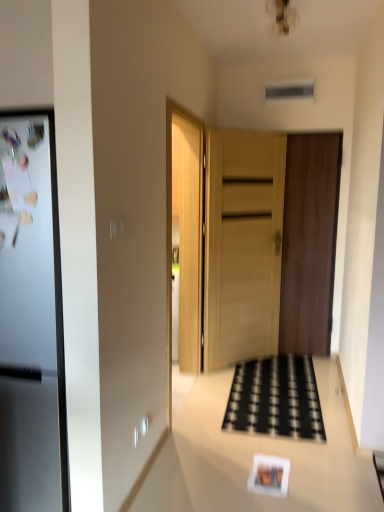
In the scene shown: In order to face black woven mat at center, should I rotate leftwards or rightwards?

A 11.049 degree turn to the right will do.

Describe the element at coordinates (269, 475) in the screenshot. I see `matte paper postcard at lower center` at that location.

I want to click on white glossy counter top at center, so click(264, 453).

Where is `black woven mat at center`? black woven mat at center is located at coordinates (276, 399).

Considering the relative sizes of wooden door at center, which appears as the 2th door when viewed from the right, and sleek metallic fridge at left in the image provided, is wooden door at center, which appears as the 2th door when viewed from the right, taller than sleek metallic fridge at left?

Yes.

Considering the relative sizes of wooden door at center, which appears as the 2th door when viewed from the right, and sleek metallic fridge at left in the image provided, is wooden door at center, which appears as the 2th door when viewed from the right, bigger than sleek metallic fridge at left?

Incorrect, wooden door at center, which appears as the 2th door when viewed from the right, is not larger than sleek metallic fridge at left.

From the image's perspective, which is below, wooden door at center, which is the first door from left to right, or sleek metallic fridge at left?

sleek metallic fridge at left appears lower in the image.

This screenshot has height=512, width=384. In order to click on counter top in front of the wooden door at center, which appears as the 2th door when viewed from the right in this screenshot , I will do `click(264, 453)`.

Is wooden door at center, which is the first door from left to right, turned away from white glossy counter top at center?

No, wooden door at center, which is the first door from left to right,'s orientation is not away from white glossy counter top at center.

Would you say wooden door at center, which appears as the 2th door when viewed from the right, contains white glossy counter top at center?

Actually, white glossy counter top at center is outside wooden door at center, which appears as the 2th door when viewed from the right.

Which object is further away from the camera, wooden door at center, which appears as the 2th door when viewed from the right, or white glossy counter top at center?

wooden door at center, which appears as the 2th door when viewed from the right.

Is point (284, 328) farther from viewer compared to point (55, 501)?

Yes.

Is dark brown wood door at center, the second door viewed from the left, positioned with its back to sleek metallic fridge at left?

dark brown wood door at center, the second door viewed from the left, does not have its back to sleek metallic fridge at left.

From a real-world perspective, between dark brown wood door at center, the second door viewed from the left, and sleek metallic fridge at left, who is vertically higher?

dark brown wood door at center, the second door viewed from the left, is physically above.

Do you think dark brown wood door at center, the second door viewed from the left, is within sleek metallic fridge at left, or outside of it?

dark brown wood door at center, the second door viewed from the left, exists outside the volume of sleek metallic fridge at left.

Where is `fridge lying above the black woven mat at center (from the image's perspective)`? fridge lying above the black woven mat at center (from the image's perspective) is located at coordinates (31, 319).

From a real-world perspective, which object rests below the other?

From a 3D spatial view, black woven mat at center is below.

Would you say sleek metallic fridge at left is a long distance from black woven mat at center?

Absolutely, sleek metallic fridge at left is distant from black woven mat at center.

From the image's perspective, is sleek metallic fridge at left beneath black woven mat at center?

Incorrect, from the image's perspective, sleek metallic fridge at left is higher than black woven mat at center.

From a real-world perspective, which is physically above, white glossy counter top at center or sleek metallic fridge at left?

In real-world perspective, sleek metallic fridge at left is above.

From the image's perspective, does white glossy counter top at center appear higher than sleek metallic fridge at left?

Incorrect, from the image's perspective, white glossy counter top at center is lower than sleek metallic fridge at left.

How distant is white glossy counter top at center from sleek metallic fridge at left?

white glossy counter top at center is 4.24 feet from sleek metallic fridge at left.

Is white glossy counter top at center smaller than sleek metallic fridge at left?

Correct, white glossy counter top at center occupies less space than sleek metallic fridge at left.

Is sleek metallic fridge at left outside of matte paper postcard at lower center?

Absolutely, sleek metallic fridge at left is external to matte paper postcard at lower center.

Is sleek metallic fridge at left aimed at matte paper postcard at lower center?

No, sleek metallic fridge at left is not turned towards matte paper postcard at lower center.

From a real-world perspective, which object stands above the other?

sleek metallic fridge at left.

Where is `fridge on the left of matte paper postcard at lower center`? The height and width of the screenshot is (512, 384). fridge on the left of matte paper postcard at lower center is located at coordinates (31, 319).

Is sleek metallic fridge at left at the back of matte paper postcard at lower center?

No, matte paper postcard at lower center is not facing the opposite direction of sleek metallic fridge at left.

Is matte paper postcard at lower center not near sleek metallic fridge at left?

Yes, matte paper postcard at lower center and sleek metallic fridge at left are located far from each other.

Is matte paper postcard at lower center closer to the viewer compared to sleek metallic fridge at left?

No, it is behind sleek metallic fridge at left.

From the sleek metallic fridge at left, count 1st door to the right and point to it. Please provide its 2D coordinates.

[(242, 245)]

At what (x,y) coordinates should I click in order to perform the action: click on door that is the 1st object above the white glossy counter top at center (from a real-world perspective). Please return your answer as a coordinate pair (x, y). The image size is (384, 512). Looking at the image, I should click on (242, 245).

Considering their positions, is matte paper postcard at lower center positioned closer to wooden door at center, which is the first door from left to right, than white glossy counter top at center?

The object closer to wooden door at center, which is the first door from left to right, is white glossy counter top at center.

Consider the image. Looking at the image, which one is located closer to matte paper postcard at lower center, sleek metallic fridge at left or dark brown wood door at center, the 1th door from the right?

sleek metallic fridge at left lies closer to matte paper postcard at lower center than the other object.

From the picture: Based on their spatial positions, is matte paper postcard at lower center or white glossy counter top at center closer to black woven mat at center?

white glossy counter top at center is closer to black woven mat at center.

Based on their spatial positions, is sleek metallic fridge at left or wooden door at center, which is the first door from left to right, closer to matte paper postcard at lower center?

Among the two, sleek metallic fridge at left is located nearer to matte paper postcard at lower center.

Consider the image. Estimate the real-world distances between objects in this image. Which object is closer to dark brown wood door at center, the second door viewed from the left, matte paper postcard at lower center or wooden door at center, which is the first door from left to right?

wooden door at center, which is the first door from left to right, is closer to dark brown wood door at center, the second door viewed from the left.

From the image, which object appears to be nearer to dark brown wood door at center, the 1th door from the right, sleek metallic fridge at left or wooden door at center, which is the first door from left to right?

wooden door at center, which is the first door from left to right.

When comparing their distances from wooden door at center, which appears as the 2th door when viewed from the right, does matte paper postcard at lower center or dark brown wood door at center, the second door viewed from the left, seem further?

matte paper postcard at lower center lies further to wooden door at center, which appears as the 2th door when viewed from the right, than the other object.

Estimate the real-world distances between objects in this image. Which object is further from wooden door at center, which appears as the 2th door when viewed from the right, sleek metallic fridge at left or matte paper postcard at lower center?

sleek metallic fridge at left lies further to wooden door at center, which appears as the 2th door when viewed from the right, than the other object.

Identify the location of postcard between white glossy counter top at center and black woven mat at center from front to back. (269, 475).

You are a GUI agent. You are given a task and a screenshot of the screen. Output one action in this format:
    pyautogui.click(x=<x>, y=<y>)
    Task: Click on the postcard positioned between sleek metallic fridge at left and dark brown wood door at center, the 1th door from the right, from near to far
    This screenshot has height=512, width=384.
    Given the screenshot: What is the action you would take?
    pyautogui.click(x=269, y=475)

I want to click on postcard between white glossy counter top at center and dark brown wood door at center, the second door viewed from the left, in the front-back direction, so click(x=269, y=475).

At what (x,y) coordinates should I click in order to perform the action: click on counter top located between sleek metallic fridge at left and black woven mat at center in the left-right direction. Please return your answer as a coordinate pair (x, y). Looking at the image, I should click on (264, 453).